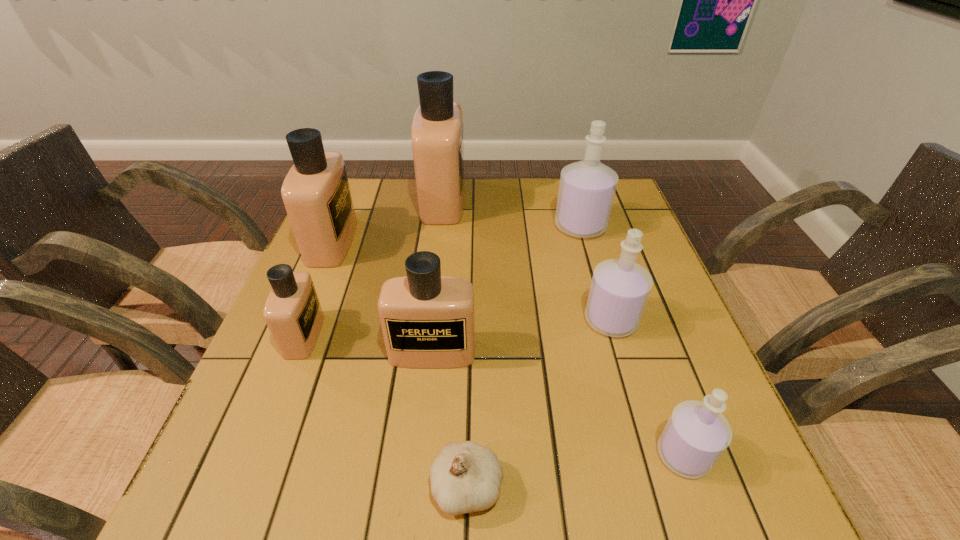
Identify the location of object that is at the far left corner. (316, 194).

You are a GUI agent. You are given a task and a screenshot of the screen. Output one action in this format:
    pyautogui.click(x=<x>, y=<y>)
    Task: Click on the object at the far right corner
    This screenshot has height=540, width=960.
    Given the screenshot: What is the action you would take?
    pyautogui.click(x=587, y=188)

Where is `object at the near right corner`? Image resolution: width=960 pixels, height=540 pixels. object at the near right corner is located at coordinates (696, 435).

Locate an element on the screen. The height and width of the screenshot is (540, 960). free point at the far edge is located at coordinates (526, 199).

The height and width of the screenshot is (540, 960). Identify the location of free space at the near edge. (529, 496).

Locate an element on the screen. This screenshot has height=540, width=960. free space at the left edge of the desktop is located at coordinates (325, 344).

In the image, there is a desktop. Identify the location of vacant space at the right edge. (627, 364).

This screenshot has width=960, height=540. In order to click on vacant space at the near right corner of the desktop in this screenshot , I will do pos(723,477).

Where is `free spot between the nearest perfume and the tallest object`? free spot between the nearest perfume and the tallest object is located at coordinates (564, 328).

Find the location of `unoccupied area between the biggest purple perfume and the tallest object`. unoccupied area between the biggest purple perfume and the tallest object is located at coordinates (512, 213).